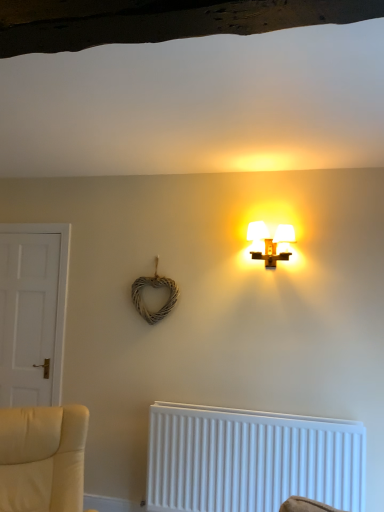
Question: Considering the positions of matte white lamp at upper center and white plastic radiator at lower center in the image, is matte white lamp at upper center taller or shorter than white plastic radiator at lower center?

Choices:
 (A) short
 (B) tall

Answer: (A)

Question: Is matte white lamp at upper center wider or thinner than white plastic radiator at lower center?

Choices:
 (A) wide
 (B) thin

Answer: (A)

Question: Which object is positioned closest to the matte white lamp at upper center?

Choices:
 (A) white plastic radiator at lower center
 (B) white matte door at left

Answer: (A)

Question: Which of these objects is positioned farthest from the white plastic radiator at lower center?

Choices:
 (A) white matte door at left
 (B) matte white lamp at upper center

Answer: (A)